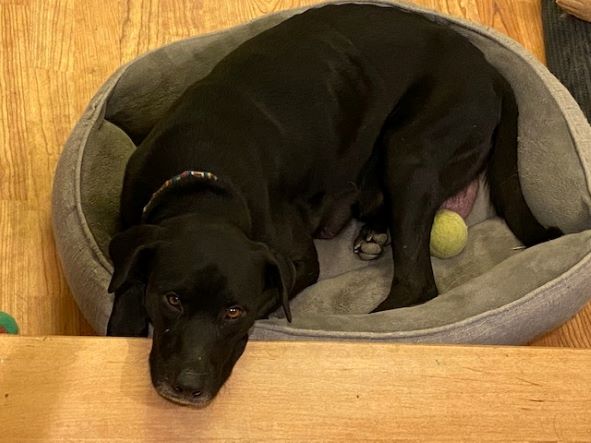
The image size is (591, 443). I want to click on ball toy, so click(457, 238).